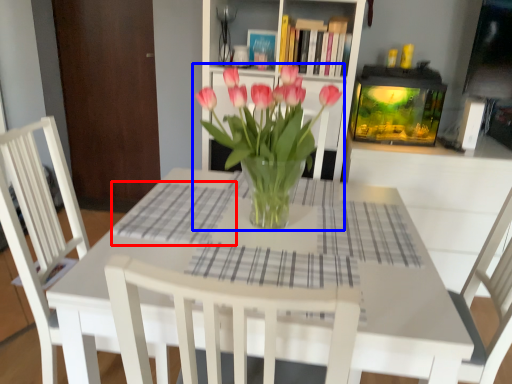
Question: Which object is further to the camera taking this photo, plaid (highlighted by a red box) or houseplant (highlighted by a blue box)?

Choices:
 (A) plaid
 (B) houseplant

Answer: (A)